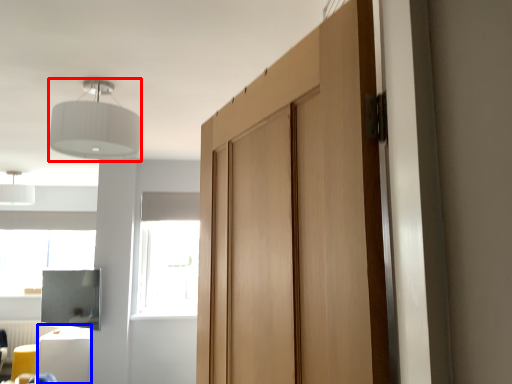
Question: Which object is closer to the camera taking this photo, light fixture (highlighted by a red box) or furniture (highlighted by a blue box)?

Choices:
 (A) light fixture
 (B) furniture

Answer: (A)